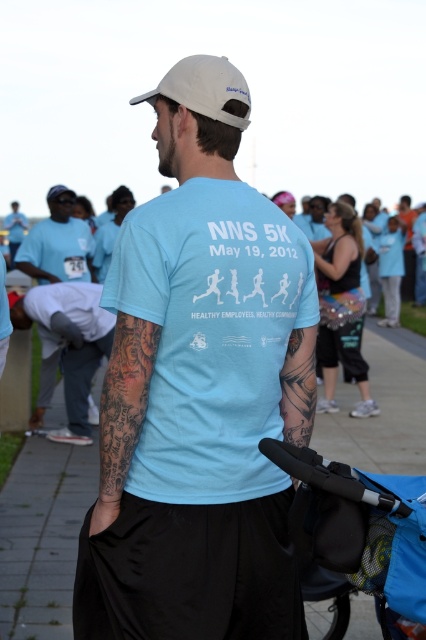
Question: Which object is closer to the camera taking this photo?

Choices:
 (A) light gray concrete pavement at center
 (B) gray fabric pants at lower left

Answer: (A)

Question: Is blue fabric stroller at lower right behind gray fabric pants at lower left?

Choices:
 (A) no
 (B) yes

Answer: (A)

Question: Is light gray concrete pavement at center below gray fabric pants at lower left?

Choices:
 (A) yes
 (B) no

Answer: (A)

Question: Is the position of light blue t-shirt at center more distant than that of light gray concrete pavement at center?

Choices:
 (A) no
 (B) yes

Answer: (A)

Question: Which point appears farthest from the camera in this image?

Choices:
 (A) (31, 266)
 (B) (31, 424)
 (C) (23, 460)

Answer: (A)

Question: Which point is farther to the camera?

Choices:
 (A) [x=54, y=348]
 (B) [x=230, y=72]

Answer: (A)